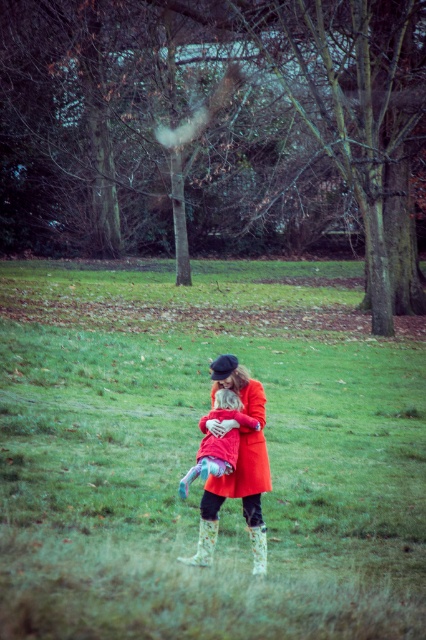
Question: Does matte orange coat at center appear on the left side of white floral rubber boot at lower center?

Choices:
 (A) no
 (B) yes

Answer: (A)

Question: Among these points, which one is farthest from the camera?

Choices:
 (A) (232, 461)
 (B) (98, 465)
 (C) (259, 532)
 (D) (262, 528)

Answer: (B)

Question: Which of the following is the closest to the observer?

Choices:
 (A) (261, 547)
 (B) (141, 396)
 (C) (199, 560)
 (D) (247, 502)

Answer: (A)

Question: Is green grassy field at center closer to the viewer compared to matte orange coat at center?

Choices:
 (A) no
 (B) yes

Answer: (B)

Question: Which of these objects is positioned farthest from the white floral rubber boot at lower center?

Choices:
 (A) matte orange coat at center
 (B) green grassy field at center
 (C) fluffy pink coat at center

Answer: (B)

Question: Is the position of fluffy pink coat at center more distant than that of white floral rubber boot at lower center?

Choices:
 (A) no
 (B) yes

Answer: (A)